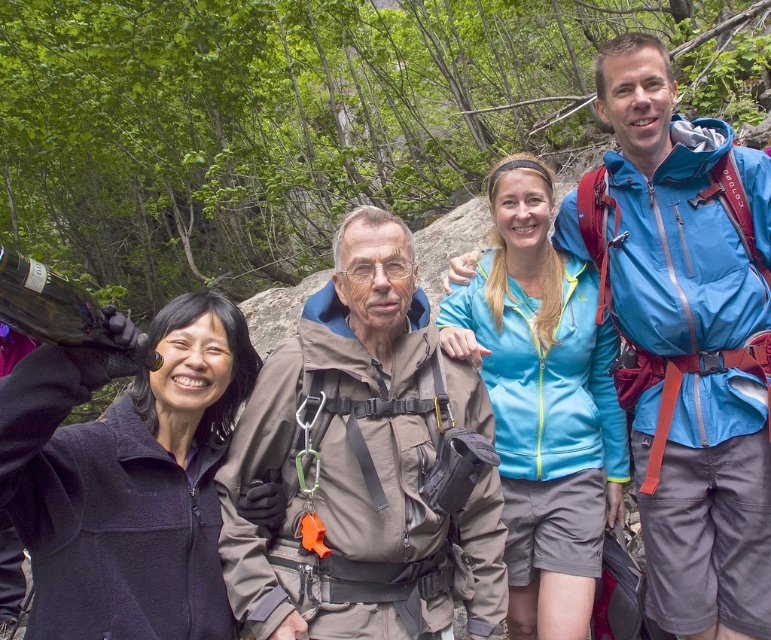
Based on the scene description, which object is wider, the matte brown jacket at center or the dark purple fleece jacket at upper left?

The matte brown jacket at center might be wider than dark purple fleece jacket at upper left according to the description.

You are a hiker who wants to borrow a jacket from the group. The group has a matte brown jacket at center and a dark purple fleece jacket at upper left. Which jacket is closer to you if you are standing in front of the group?

The matte brown jacket at center is closer to you because it is positioned over the dark purple fleece jacket at upper left, meaning it is in front.

You are a photographer positioned at the back of the group. You want to take a photo of both the matte brown jacket at center and the light blue fleece jacket at center without any obstruction. Based on their positions, which jacket should you focus on first to ensure both are in frame?

The matte brown jacket at center is below the light blue fleece jacket at center, so you should focus on the light blue fleece jacket at center first to ensure both are visible in the frame.